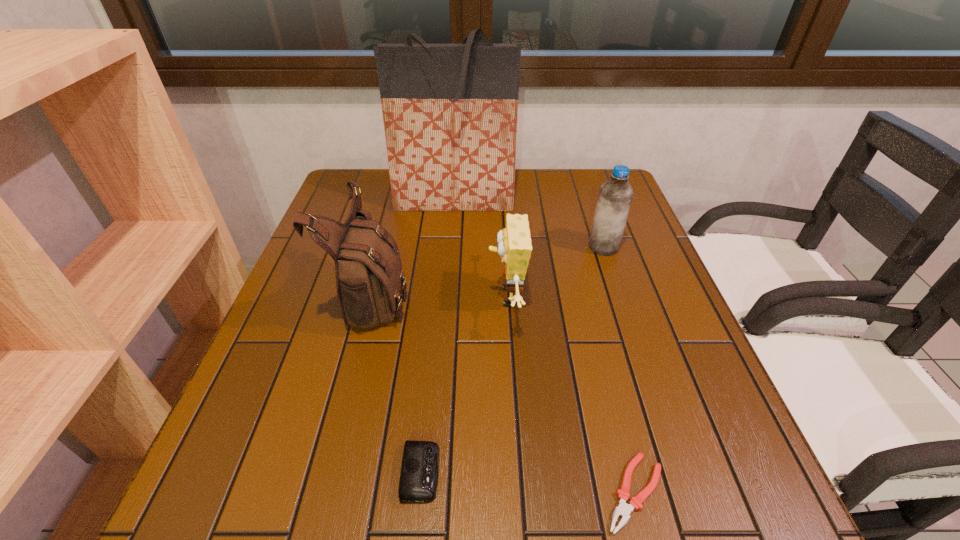
Identify the location of vacant area that lies between the fifth tallest object and the fourth tallest object. This screenshot has width=960, height=540. (464, 385).

Locate an element on the screen. vacant area that lies between the farthest object and the pliers is located at coordinates (544, 347).

Where is `vacant space that is in between the sponge and the shopping bag`? The image size is (960, 540). vacant space that is in between the sponge and the shopping bag is located at coordinates (480, 249).

Locate an element on the screen. This screenshot has width=960, height=540. free point between the third shortest object and the tallest object is located at coordinates (480, 249).

Locate an element on the screen. The width and height of the screenshot is (960, 540). free spot between the pliers and the sponge is located at coordinates (570, 395).

Where is `unoccupied area between the fifth shortest object and the second shortest object`? The height and width of the screenshot is (540, 960). unoccupied area between the fifth shortest object and the second shortest object is located at coordinates (397, 383).

This screenshot has width=960, height=540. In order to click on object identified as the fourth closest to the alarm clock in this screenshot , I will do `click(615, 196)`.

Locate an element on the screen. The image size is (960, 540). the second closest object to the fourth tallest object is located at coordinates (369, 278).

Find the location of a particular element. The image size is (960, 540). vacant space that satisfies the following two spatial constraints: 1. on the display of the shortest object; 2. on the left side of the fifth tallest object is located at coordinates (419, 492).

Where is `vacant space that satisfies the following two spatial constraints: 1. on the front side of the second farthest object; 2. on the display of the alarm clock`? This screenshot has width=960, height=540. vacant space that satisfies the following two spatial constraints: 1. on the front side of the second farthest object; 2. on the display of the alarm clock is located at coordinates (680, 472).